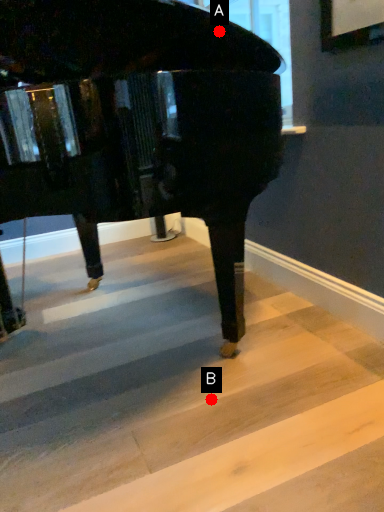
Question: Two points are circled on the image, labeled by A and B beside each circle. Which point is closer to the camera taking this photo?

Choices:
 (A) A is closer
 (B) B is closer

Answer: (B)